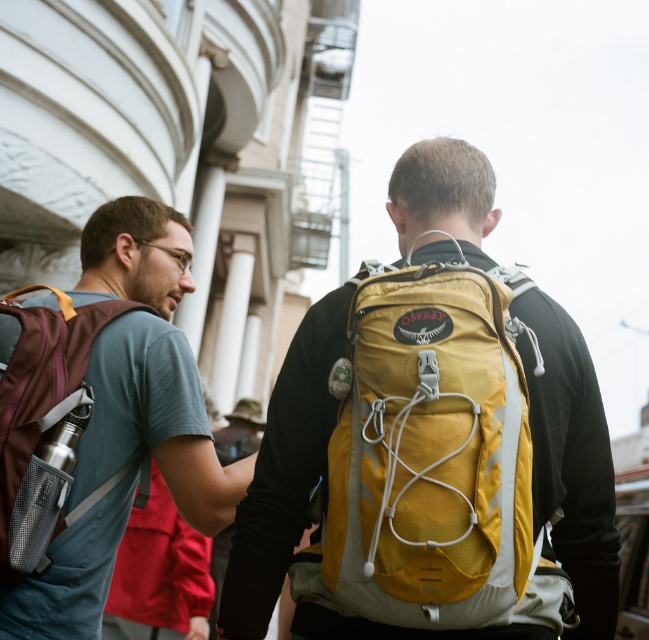
You are a delivery person needing to pack two backpacks into a small storage container. The container can only fit items that take up the same amount of space. Based on the image, can you determine if the yellow fabric backpack at center and the matte purple backpack at left will both fit?

The yellow fabric backpack at center occupies less space than the matte purple backpack at left, so they do not take up the same amount of space. Therefore, both backpacks cannot fit into the container that requires items to have equal space requirements.

You are a delivery person who needs to place a package between the matte brown backpack at left and the matte purple backpack at left. The package requires 10 feet of space. Is there enough space between them?

The matte brown backpack at left and matte purple backpack at left are 13.62 feet apart, which is more than the required 10 feet, so there is enough space to place the package between them.